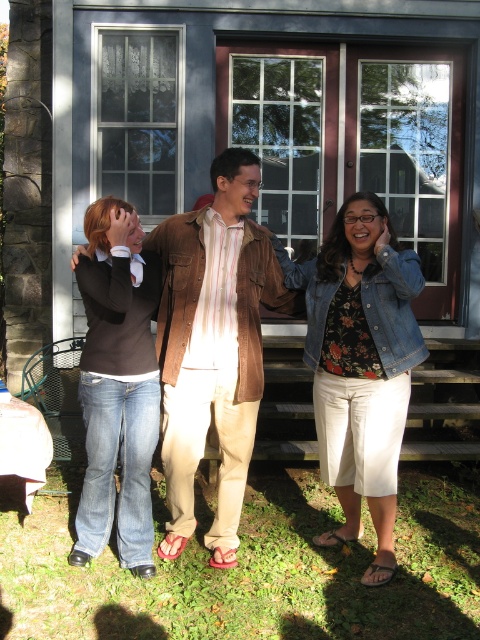
Who is more forward, (227,563) or (119,417)?

Point (119,417)

Between brown corduroy shirt at center and denim jeans at lower left, which one is positioned lower?

Positioned lower is denim jeans at lower left.

Which is in front, point (220, 156) or point (132, 387)?

Point (132, 387)

The height and width of the screenshot is (640, 480). I want to click on brown corduroy shirt at center, so (214, 346).

Is point (386, 301) farther from camera compared to point (109, 209)?

No, it is not.

From the picture: Which is more to the right, floral print blouse at center or denim jeans at lower left?

From the viewer's perspective, floral print blouse at center appears more on the right side.

You are a GUI agent. You are given a task and a screenshot of the screen. Output one action in this format:
    pyautogui.click(x=<x>, y=<y>)
    Task: Click on the floral print blouse at center
    The image size is (480, 640).
    Given the screenshot: What is the action you would take?
    pyautogui.click(x=360, y=364)

In order to click on floral print blouse at center in this screenshot , I will do `click(360, 364)`.

Is brown corduroy shirt at center positioned before floral print blouse at center?

No, it is behind floral print blouse at center.

The width and height of the screenshot is (480, 640). Find the location of `brown corduroy shirt at center`. brown corduroy shirt at center is located at coordinates (214, 346).